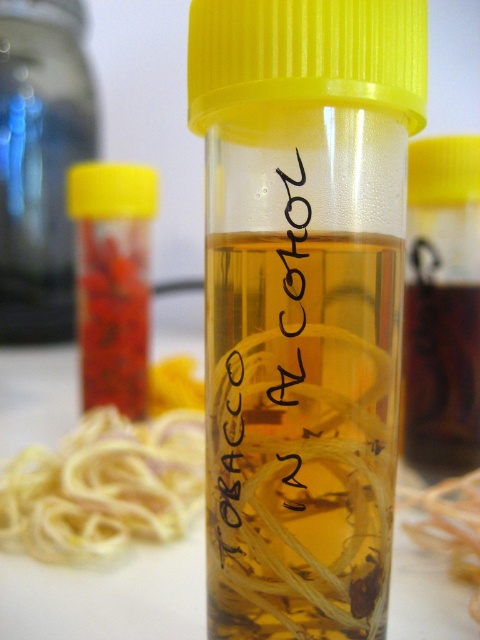
Consider the image. Is translucent plastic tube at center bigger than translucent plastic container at center?

No, translucent plastic tube at center is not bigger than translucent plastic container at center.

Is translucent plastic tube at center smaller than translucent plastic container at center?

Yes.

Is point (328, 624) behind point (72, 186)?

No, (328, 624) is in front of (72, 186).

This screenshot has width=480, height=640. I want to click on translucent plastic tube at center, so click(302, 301).

Who is shorter, yellow rubber band at lower left or translucent plastic container at center?

Standing shorter between the two is yellow rubber band at lower left.

Can you confirm if yellow rubber band at lower left is taller than translucent plastic container at center?

Incorrect, yellow rubber band at lower left's height is not larger of translucent plastic container at center's.

Is point (147, 442) in front of point (86, 321)?

That is True.

Where is `yellow rubber band at lower left`? This screenshot has width=480, height=640. yellow rubber band at lower left is located at coordinates (104, 486).

Is translucent plastic tube at center below brown translucent bottle at center?

Yes, translucent plastic tube at center is below brown translucent bottle at center.

Which is above, translucent plastic tube at center or brown translucent bottle at center?

brown translucent bottle at center

Locate an element on the screen. translucent plastic tube at center is located at coordinates (302, 301).